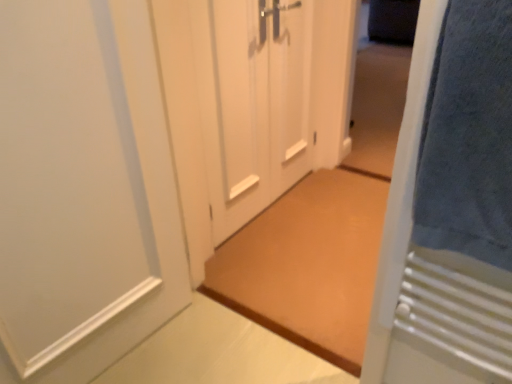
What do you see at coordinates (290, 92) in the screenshot?
I see `white matte door at center, acting as the 2th door starting from the right` at bounding box center [290, 92].

In order to click on white matte door at center, placed as the 3th door when sorted from left to right in this screenshot , I will do `click(290, 92)`.

At what (x,y) coordinates should I click in order to perform the action: click on blue soft towel at right. Please return your answer as a coordinate pair (x, y). Image resolution: width=512 pixels, height=384 pixels. Looking at the image, I should click on (468, 137).

Measure the distance between white matte door at center, which is the third door from right to left, and camera.

white matte door at center, which is the third door from right to left, and camera are 5.11 feet apart.

Locate an element on the screen. white matte door at left, the first door when ordered from left to right is located at coordinates (83, 189).

Locate an element on the screen. The height and width of the screenshot is (384, 512). blue towel at right, the first door in the right-to-left sequence is located at coordinates (450, 207).

Identify the location of white matte door at center, acting as the 2th door starting from the right. (290, 92).

Considering the relative sizes of brown matte doormat at center and blue towel at right, which is counted as the 4th door, starting from the left, in the image provided, is brown matte doormat at center smaller than blue towel at right, which is counted as the 4th door, starting from the left,?

Actually, brown matte doormat at center might be larger than blue towel at right, which is counted as the 4th door, starting from the left.

How different are the orientations of brown matte doormat at center and blue towel at right, the first door in the right-to-left sequence, in degrees?

The angular difference between brown matte doormat at center and blue towel at right, the first door in the right-to-left sequence, is 178 degrees.

Between brown matte doormat at center and blue towel at right, which is counted as the 4th door, starting from the left, which one has more height?

blue towel at right, which is counted as the 4th door, starting from the left.

Is brown matte doormat at center to the left or to the right of blue towel at right, which is counted as the 4th door, starting from the left, in the image?

brown matte doormat at center is to the left of blue towel at right, which is counted as the 4th door, starting from the left.

Where is `the 1st door counting from the right side of the white matte door at center, the second door in the left-to-right sequence`? the 1st door counting from the right side of the white matte door at center, the second door in the left-to-right sequence is located at coordinates (290, 92).

Considering the relative sizes of white matte door at center, the second door in the left-to-right sequence, and white matte door at center, placed as the 3th door when sorted from left to right, in the image provided, is white matte door at center, the second door in the left-to-right sequence, bigger than white matte door at center, placed as the 3th door when sorted from left to right,?

Yes.

Considering the relative sizes of white matte door at center, the second door in the left-to-right sequence, and white matte door at center, placed as the 3th door when sorted from left to right, in the image provided, is white matte door at center, the second door in the left-to-right sequence, shorter than white matte door at center, placed as the 3th door when sorted from left to right,?

No, white matte door at center, the second door in the left-to-right sequence, is not shorter than white matte door at center, placed as the 3th door when sorted from left to right.

Choose the correct answer: Is white matte door at center, placed as the 3th door when sorted from left to right, inside white matte door at center, which is the third door from right to left, or outside it?

white matte door at center, placed as the 3th door when sorted from left to right, is contained in white matte door at center, which is the third door from right to left.

Is white matte door at center, placed as the 3th door when sorted from left to right, bigger or smaller than white matte door at center, the second door in the left-to-right sequence?

In the image, white matte door at center, placed as the 3th door when sorted from left to right, appears to be smaller than white matte door at center, the second door in the left-to-right sequence.

Is white matte door at center, placed as the 3th door when sorted from left to right, in front of or behind white matte door at center, the second door in the left-to-right sequence, in the image?

Clearly, white matte door at center, placed as the 3th door when sorted from left to right, is behind white matte door at center, the second door in the left-to-right sequence.

What's the angular difference between white matte door at center, placed as the 3th door when sorted from left to right, and white matte door at center, the second door in the left-to-right sequence,'s facing directions?

They differ by 0.00146 degrees in their facing directions.

From the image's perspective, is brown matte doormat at center above white matte door at center, the second door in the left-to-right sequence?

No, from the image's perspective, brown matte doormat at center is not above white matte door at center, the second door in the left-to-right sequence.

Which is further, (258, 270) or (218, 196)?

The point (218, 196) is more distant.

In the image, is brown matte doormat at center positioned in front of or behind white matte door at center, the second door in the left-to-right sequence?

Visually, brown matte doormat at center is located behind white matte door at center, the second door in the left-to-right sequence.

Who is taller, brown matte doormat at center or white matte door at center, which is the third door from right to left?

With more height is white matte door at center, which is the third door from right to left.

In terms of width, does white matte door at center, the second door in the left-to-right sequence, look wider or thinner when compared to white matte door at left, which appears as the fourth door when viewed from the right?

white matte door at center, the second door in the left-to-right sequence, is thinner than white matte door at left, which appears as the fourth door when viewed from the right.

From the image's perspective, who appears lower, white matte door at center, which is the third door from right to left, or white matte door at left, which appears as the fourth door when viewed from the right?

white matte door at left, which appears as the fourth door when viewed from the right.

Consider the image. Which is further, (262, 133) or (8, 131)?

The point (262, 133) is more distant.

Does white matte door at center, the second door in the left-to-right sequence, have a greater height compared to white matte door at left, the first door when ordered from left to right?

No.

Is brown matte doormat at center spatially inside blue soft towel at right, or outside of it?

brown matte doormat at center is not enclosed by blue soft towel at right.

Image resolution: width=512 pixels, height=384 pixels. Identify the location of bath towel on the right side of brown matte doormat at center. (468, 137).

Does point (271, 268) come closer to viewer compared to point (444, 209)?

No, it is behind (444, 209).

In the scene shown: From a real-world perspective, is white matte door at left, which appears as the fourth door when viewed from the right, below blue soft towel at right?

Yes, from a real-world perspective, white matte door at left, which appears as the fourth door when viewed from the right, is below blue soft towel at right.

Can you confirm if white matte door at left, which appears as the fourth door when viewed from the right, is smaller than blue soft towel at right?

Actually, white matte door at left, which appears as the fourth door when viewed from the right, might be larger than blue soft towel at right.

I want to click on door that is the 3rd object to the left of the blue soft towel at right, starting at the anchor, so coord(83,189).

Who is more distant, white matte door at left, the first door when ordered from left to right, or blue soft towel at right?

white matte door at left, the first door when ordered from left to right, is more distant.

From a real-world perspective, starting from the brown matte doormat at center, which door is the 4th one vertically above it? Please provide its 2D coordinates.

[(450, 207)]

From the white matte door at center, acting as the 2th door starting from the right, count the 1st door to the left and point to it. Please provide its 2D coordinates.

[(259, 106)]

When comparing their distances from white matte door at left, which appears as the fourth door when viewed from the right, does white matte door at center, acting as the 2th door starting from the right, or brown matte doormat at center seem closer?

Based on the image, brown matte doormat at center appears to be nearer to white matte door at left, which appears as the fourth door when viewed from the right.

Which object lies nearer to the anchor point blue towel at right, which is counted as the 4th door, starting from the left, white matte door at center, which is the third door from right to left, or white matte door at left, the first door when ordered from left to right?

Among the two, white matte door at left, the first door when ordered from left to right, is located nearer to blue towel at right, which is counted as the 4th door, starting from the left.

Looking at the image, which one is located closer to white matte door at center, which is the third door from right to left, blue soft towel at right or white matte door at center, acting as the 2th door starting from the right?

white matte door at center, acting as the 2th door starting from the right, is positioned closer to the anchor white matte door at center, which is the third door from right to left.

Which object lies further to the anchor point white matte door at center, placed as the 3th door when sorted from left to right, brown matte doormat at center or blue soft towel at right?

The object further to white matte door at center, placed as the 3th door when sorted from left to right, is blue soft towel at right.

Estimate the real-world distances between objects in this image. Which object is further from blue soft towel at right, white matte door at left, the first door when ordered from left to right, or blue towel at right, which is counted as the 4th door, starting from the left?

white matte door at left, the first door when ordered from left to right, is positioned further to the anchor blue soft towel at right.

From the image, which object appears to be nearer to white matte door at center, which is the third door from right to left, blue soft towel at right or brown matte doormat at center?

brown matte doormat at center lies closer to white matte door at center, which is the third door from right to left, than the other object.

Which object lies nearer to the anchor point white matte door at center, which is the third door from right to left, blue towel at right, the first door in the right-to-left sequence, or blue soft towel at right?

blue towel at right, the first door in the right-to-left sequence, is positioned closer to the anchor white matte door at center, which is the third door from right to left.

Looking at this image, estimate the real-world distances between objects in this image. Which object is closer to blue towel at right, which is counted as the 4th door, starting from the left, blue soft towel at right or white matte door at center, placed as the 3th door when sorted from left to right?

Among the two, blue soft towel at right is located nearer to blue towel at right, which is counted as the 4th door, starting from the left.

Find the location of a particular element. doormat between blue towel at right, which is counted as the 4th door, starting from the left, and white matte door at center, acting as the 2th door starting from the right, along the z-axis is located at coordinates (308, 264).

I want to click on bath towel between white matte door at left, the first door when ordered from left to right, and blue towel at right, which is counted as the 4th door, starting from the left, in the horizontal direction, so click(x=468, y=137).

I want to click on doormat between blue soft towel at right and white matte door at center, acting as the 2th door starting from the right, in the front-back direction, so click(308, 264).

Find the location of a particular element. This screenshot has width=512, height=384. door between white matte door at left, the first door when ordered from left to right, and brown matte doormat at center from front to back is located at coordinates (259, 106).